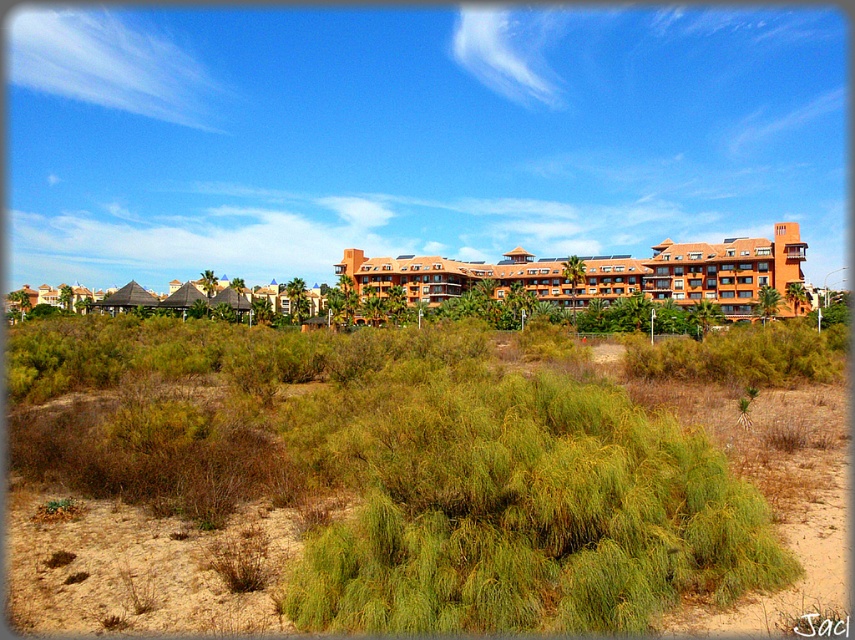
Who is lower down, green shrubbery at center or orange clay resort at center?

Positioned lower is green shrubbery at center.

Is point (839, 330) closer to viewer compared to point (726, 257)?

That is True.

What are the coordinates of `green shrubbery at center` in the screenshot? It's located at (405, 468).